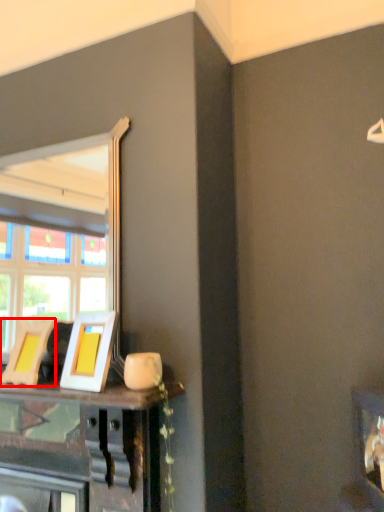
Question: In this image, where is picture frame (annotated by the red box) located relative to picture frame?

Choices:
 (A) left
 (B) right

Answer: (A)